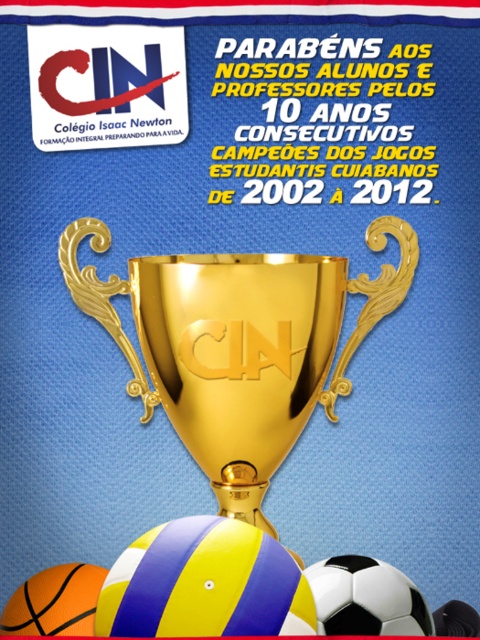
Does gold shiny trophy cup at center have a greater width compared to yellowmattebeach ball at center?

Yes, gold shiny trophy cup at center is wider than yellowmattebeach ball at center.

This screenshot has height=640, width=480. What do you see at coordinates (239, 344) in the screenshot?
I see `gold shiny trophy cup at center` at bounding box center [239, 344].

Who is more forward, (180, 394) or (235, 600)?

Point (235, 600)

Find the location of a particular element. gold shiny trophy cup at center is located at coordinates (239, 344).

Is yellowmattebeach ball at center shorter than yellow matte beach ball at lower center?

Incorrect, yellowmattebeach ball at center's height does not fall short of yellow matte beach ball at lower center's.

Which of these two, yellowmattebeach ball at center or yellow matte beach ball at lower center, stands shorter?

yellow matte beach ball at lower center

Locate an element on the screen. yellowmattebeach ball at center is located at coordinates (203, 582).

Who is more distant from viewer, (348,342) or (336,602)?

Point (348,342)

Which is more to the right, gold shiny trophy cup at center or white matte beach ball at lower center?

white matte beach ball at lower center is more to the right.

Find the location of a particular element. gold shiny trophy cup at center is located at coordinates (239, 344).